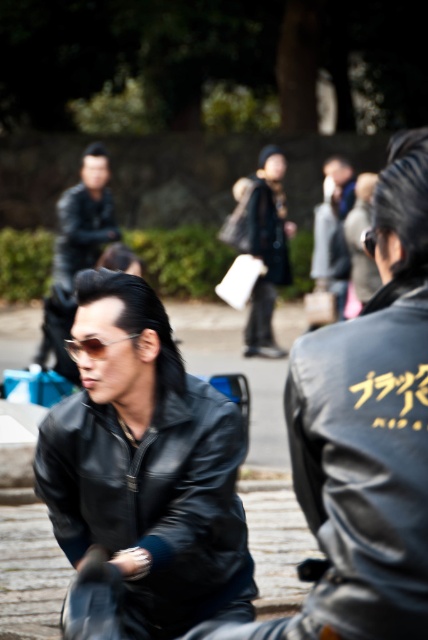
You are a photographer trying to capture a closeup shot of the matte black leather jacket at center and the matte black goggles at center. Which object should you zoom in more on to ensure both fit in the frame?

Since the matte black leather jacket at center is wider than the matte black goggles at center, you should zoom in more on the matte black leather jacket at center to ensure both fit in the frame.

You are a photographer trying to capture a clear shot of both the matte black leather jacket at center and the matte black goggles at center. Since the background is slightly out of focus, you want to ensure both objects are in focus. Given their sizes, which object would you need to focus on first to ensure both are sharp?

The matte black leather jacket at center is much taller than the matte black goggles at center, so focusing on the larger object first would help ensure both are in focus.